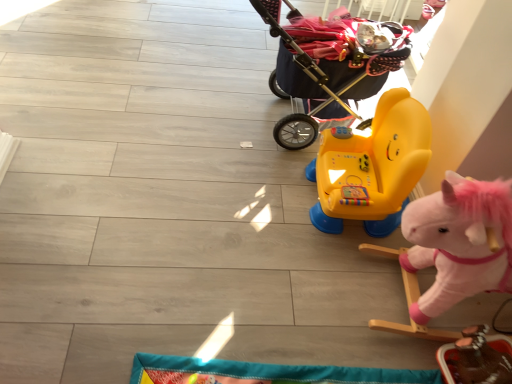
Question: In the image, is smooth brown wooden toy at lower right, which is the 3th toy in top-to-bottom order, positioned in front of or behind dark blue fabric baby carriage at upper right?

Choices:
 (A) front
 (B) behind

Answer: (A)

Question: In terms of height, does smooth brown wooden toy at lower right, placed as the first toy when sorted from bottom to top, look taller or shorter compared to dark blue fabric baby carriage at upper right?

Choices:
 (A) tall
 (B) short

Answer: (B)

Question: Which is farther from the smooth brown wooden toy at lower right, which is the 3th toy in top-to-bottom order?

Choices:
 (A) yellow plastic ride-on toy at center, the 1th toy positioned from the top
 (B) fluffy pink rocking horse at right, the 2th toy when ordered from bottom to top
 (C) dark blue fabric baby carriage at upper right

Answer: (C)

Question: Considering the real-world distances, which object is farthest from the smooth brown wooden toy at lower right, placed as the first toy when sorted from bottom to top?

Choices:
 (A) dark blue fabric baby carriage at upper right
 (B) fluffy pink rocking horse at right, the second toy when ordered from top to bottom
 (C) yellow plastic ride-on toy at center, arranged as the 3th toy when ordered from the bottom

Answer: (A)